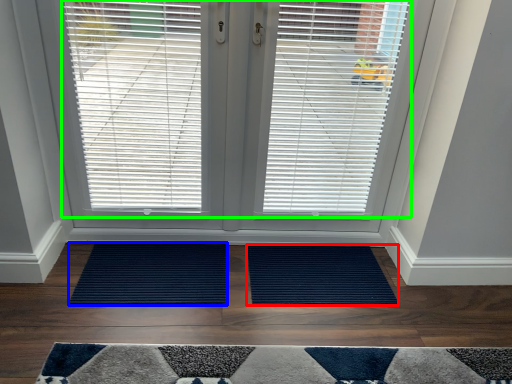
Question: Which object is positioned farthest from doormat (highlighted by a red box)? Select from doormat (highlighted by a blue box) and window blind (highlighted by a green box).

Choices:
 (A) doormat
 (B) window blind

Answer: (B)